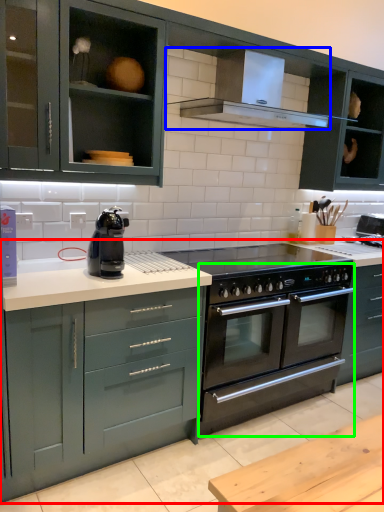
Question: Which is nearer to the countertop (highlighted by a red box)? kitchen appliance (highlighted by a blue box) or oven (highlighted by a green box).

Choices:
 (A) kitchen appliance
 (B) oven

Answer: (B)